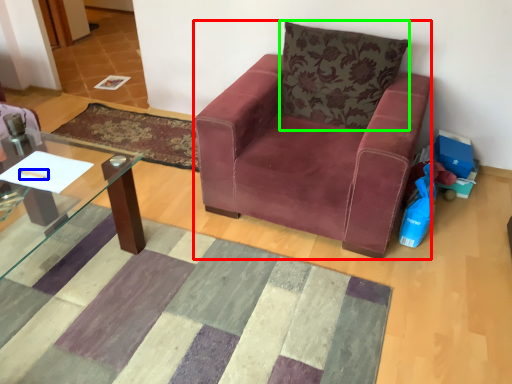
Question: Based on their relative distances, which object is farther from chair (highlighted by a red box)? Choose from pen (highlighted by a blue box) and pillow (highlighted by a green box).

Choices:
 (A) pen
 (B) pillow

Answer: (A)